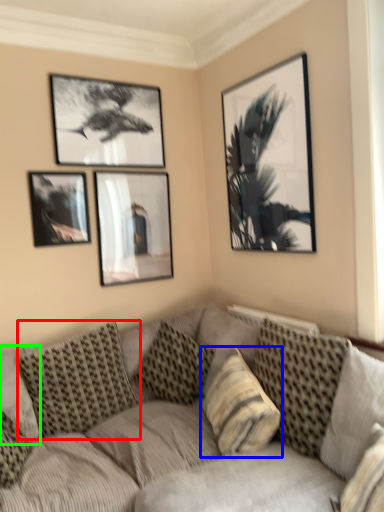
Question: Estimate the real-world distances between objects in this image. Which object is closer to pillow (highlighted by a red box), pillow (highlighted by a blue box) or pillow (highlighted by a green box)?

Choices:
 (A) pillow
 (B) pillow

Answer: (B)